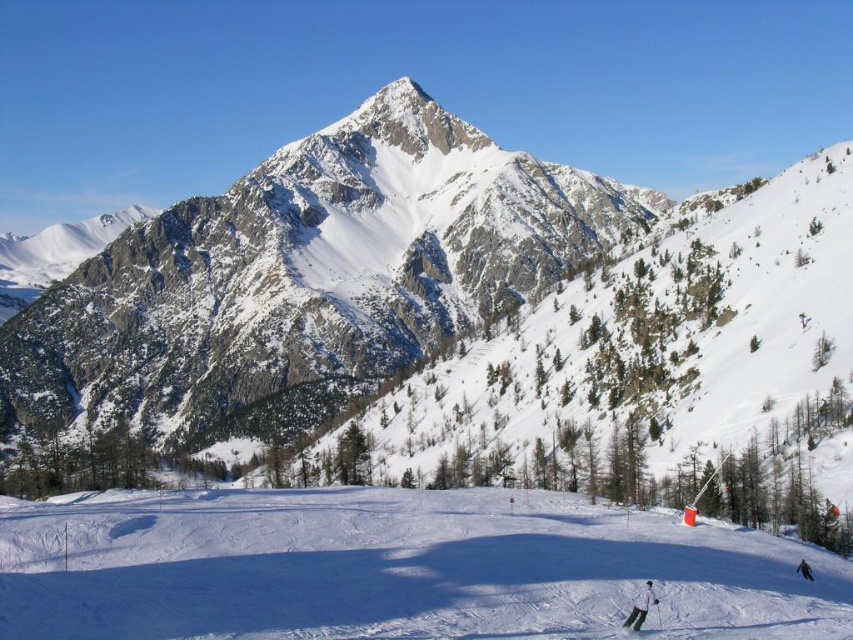
Question: Does white snow ski slope at center have a greater width compared to white matte ski at lower right?

Choices:
 (A) no
 (B) yes

Answer: (B)

Question: Can you confirm if white matte jacket at lower right is positioned to the right of white matte ski at lower right?

Choices:
 (A) no
 (B) yes

Answer: (B)

Question: From the image, what is the correct spatial relationship of snowy granite mountain at upper center in relation to white snow ski slope at center?

Choices:
 (A) left
 (B) right

Answer: (A)

Question: Which object appears closest to the camera in this image?

Choices:
 (A) snowy granite mountain at upper center
 (B) white snow ski slope at center
 (C) white matte jacket at lower right
 (D) white matte ski at lower right

Answer: (B)

Question: Estimate the real-world distances between objects in this image. Which object is closer to the white matte ski at lower right?

Choices:
 (A) white matte jacket at lower right
 (B) snowy granite mountain at upper center
 (C) white snow ski slope at center

Answer: (A)

Question: Which point is farther to the camera?

Choices:
 (A) (624, 621)
 (B) (821, 632)

Answer: (A)